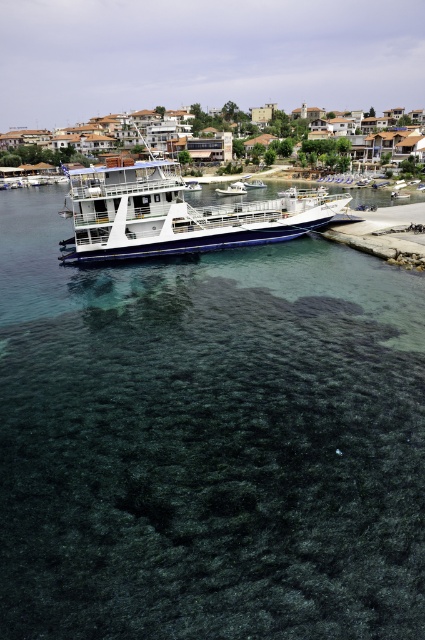
You are standing on the ferry and looking out towards the town. There are two points marked on the water surface in front of you. The first point is at coordinates point (119,246) and the second point is at point (224,195). Which point appears closer to you?

Point (119,246) is closer to the camera than point (224,195), so the first point appears closer to you.